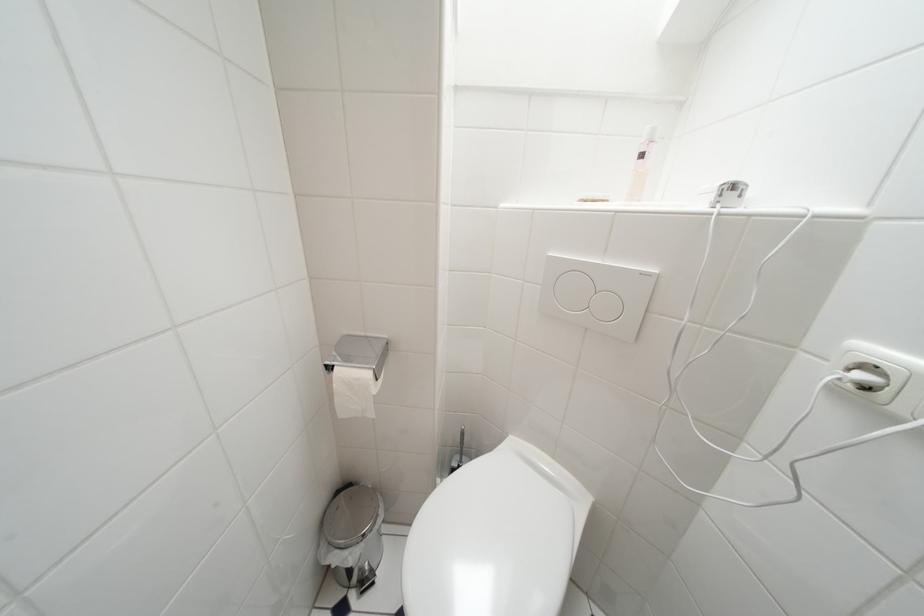
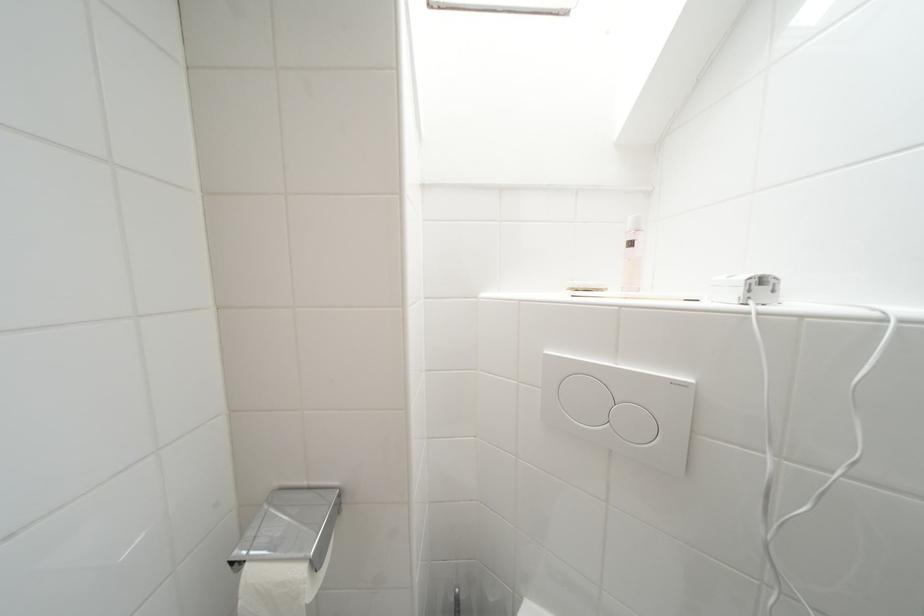
Find the pixel in the second image that matches point 372,341 in the first image.

(315, 491)